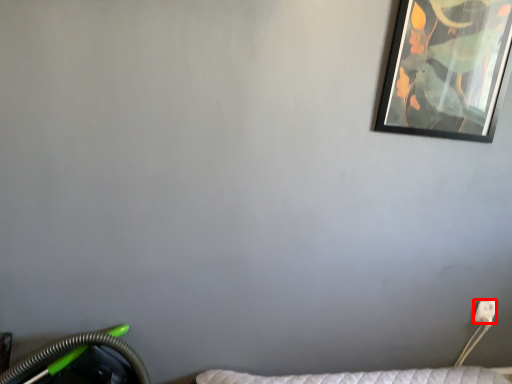
Question: Observing the image, what is the correct spatial positioning of electric outlet (annotated by the red box) in reference to picture frame?

Choices:
 (A) right
 (B) left

Answer: (A)